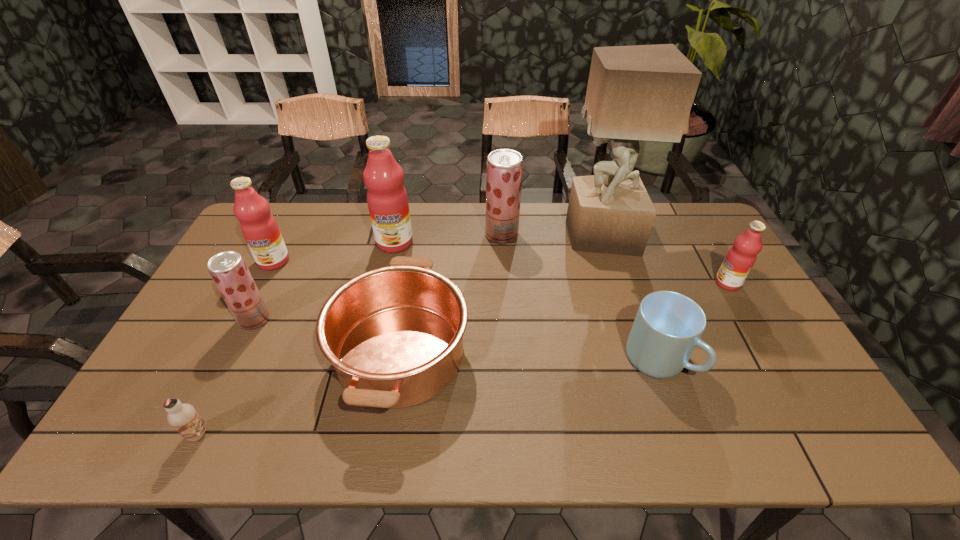
You are a GUI agent. You are given a task and a screenshot of the screen. Output one action in this format:
    pyautogui.click(x=<x>, y=<y>)
    Task: Click on the vacant space located on the label of the nearest pink fruit juice
    
    Given the screenshot: What is the action you would take?
    pyautogui.click(x=663, y=283)

Image resolution: width=960 pixels, height=540 pixels. Identify the location of vacant space located on the label of the nearest pink fruit juice. (699, 283).

Identify the location of vacant position located 0.180m on the label of the nearest pink fruit juice. The width and height of the screenshot is (960, 540). (657, 283).

I want to click on free location located on the right of the left strawberry fruit juice, so click(x=347, y=320).

Locate an element on the screen. This screenshot has height=540, width=960. vacant space located 0.160m on the right of the mug is located at coordinates (751, 360).

Image resolution: width=960 pixels, height=540 pixels. In order to click on free location located on the right of the saucepan in this screenshot , I will do coord(582,354).

Locate an element on the screen. vacant space located on the right of the chocolate milk is located at coordinates (288, 434).

Where is `sculpture present at the far edge`? The width and height of the screenshot is (960, 540). sculpture present at the far edge is located at coordinates (636, 93).

Where is `saucepan at the near edge`? The image size is (960, 540). saucepan at the near edge is located at coordinates (394, 335).

This screenshot has width=960, height=540. I want to click on chocolate milk that is positioned at the near edge, so click(x=183, y=417).